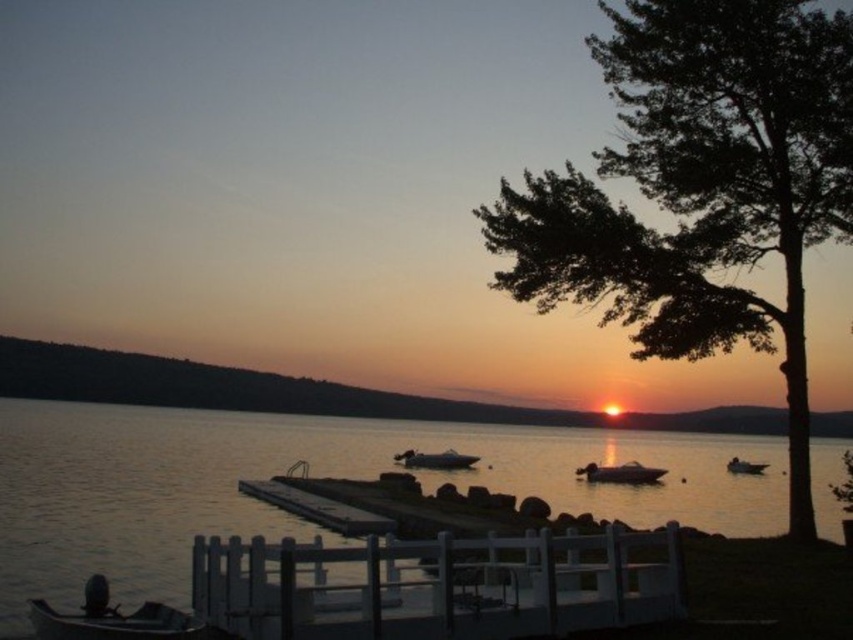
You are standing at the center of the dock and want to board the metallic gray boat at lower left. Based on its coordinates, is the boat positioned to your left or right side?

The metallic gray boat at lower left is located at coordinates point (112, 618), which places it to your left side relative to your position at the dock center.

Consider the image. You are standing on the lakeshore and want to board the metallic gray boat at lower left. Based on the scene, is the white wooden dock at lower center blocking your direct path to the boat?

The white wooden dock at lower center is positioned over the metallic gray boat at lower left, so the dock is blocking the direct path to the boat.